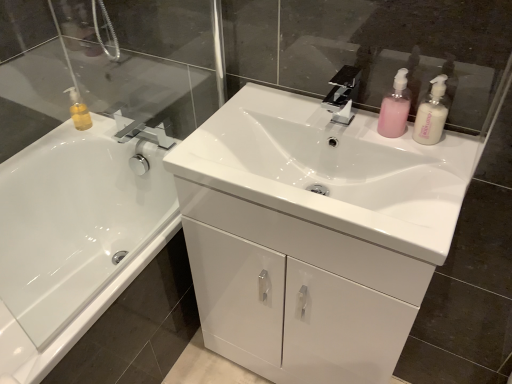
Question: Does point (398, 248) appear closer or farther from the camera than point (342, 72)?

Choices:
 (A) closer
 (B) farther

Answer: (A)

Question: Considering the positions of white glossy sink at center and black glossy faucet at center in the image, is white glossy sink at center taller or shorter than black glossy faucet at center?

Choices:
 (A) short
 (B) tall

Answer: (B)

Question: Estimate the real-world distances between objects in this image. Which object is closer to the pink matte pump bottle at upper right, which appears as the second toiletry when viewed from the back?

Choices:
 (A) white glossy cabinet at center
 (B) black glossy faucet at center
 (C) white glossy sink at center
 (D) white glossy bathtub at left
 (E) translucent plastic soap dispenser at upper left, which is the 1th toiletry from back to front

Answer: (B)

Question: Based on their relative distances, which object is nearer to the white glossy cabinet at center?

Choices:
 (A) black glossy faucet at center
 (B) white glossy sink at center
 (C) pink matte pump bottle at upper right, which is the 2th toiletry in right-to-left order
 (D) white glossy bathtub at left
 (E) pink plastic pump bottle at upper right, arranged as the 3th toiletry when viewed from the left

Answer: (B)